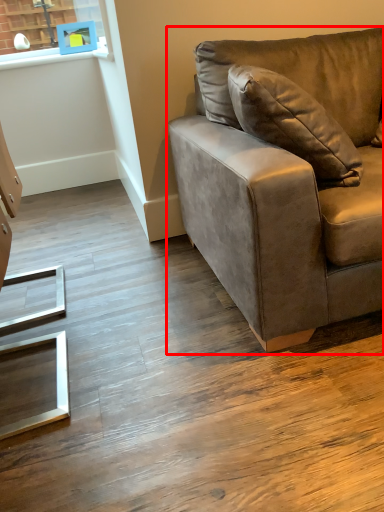
Question: From the image's perspective, where is studio couch (annotated by the red box) located in relation to picture frame in the image?

Choices:
 (A) below
 (B) above

Answer: (A)